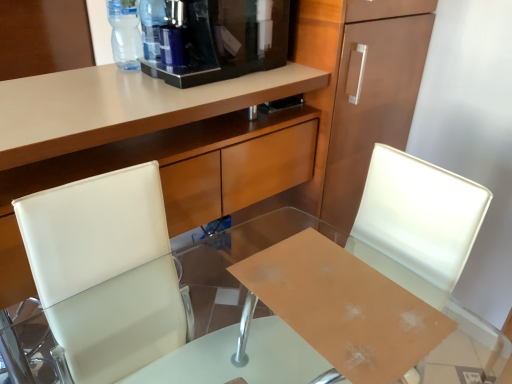
Question: From a real-world perspective, relative to white leather swivel chair at center, is black glossy coffee machine at upper center vertically above or below?

Choices:
 (A) below
 (B) above

Answer: (B)

Question: Is black glossy coffee machine at upper center inside the boundaries of white leather swivel chair at center, or outside?

Choices:
 (A) inside
 (B) outside

Answer: (B)

Question: Based on their relative distances, which object is farther from the white leather swivel chair at center?

Choices:
 (A) matte wood cabinet at upper center
 (B) transparent plastic bottle at upper center, placed as the 1th bottle when sorted from right to left
 (C) transparent plastic bottle at upper center, marked as the second bottle in a right-to-left arrangement
 (D) black glossy coffee machine at upper center
 (E) white leather chair at center

Answer: (E)

Question: Estimate the real-world distances between objects in this image. Which object is farther from the white leather chair at center?

Choices:
 (A) transparent glass desk at center
 (B) black glossy coffee machine at upper center
 (C) white leather swivel chair at center
 (D) matte wood cabinet at upper center
 (E) transparent plastic bottle at upper center, positioned as the second bottle in left-to-right order

Answer: (E)